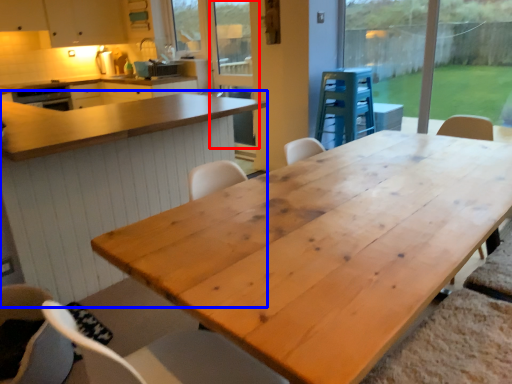
Question: Which of the following is the closest to the observer, screen door (highlighted by a red box) or table (highlighted by a blue box)?

Choices:
 (A) screen door
 (B) table

Answer: (B)